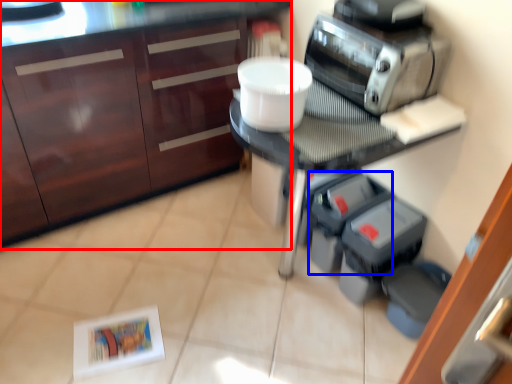
Question: Which object is closer to the camera taking this photo, cabinetry (highlighted by a red box) or appliance (highlighted by a blue box)?

Choices:
 (A) cabinetry
 (B) appliance

Answer: (A)